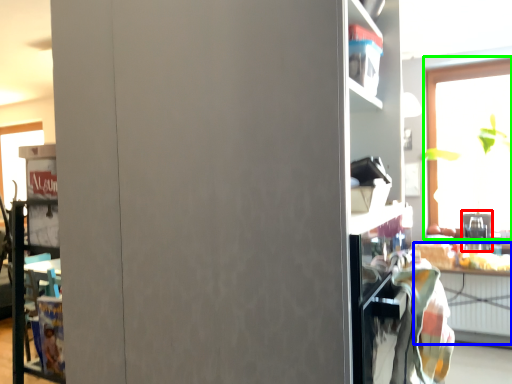
Question: Considering the real-world distances, which object is farthest from appliance (highlighted by a red box)? table (highlighted by a blue box) or window (highlighted by a green box)?

Choices:
 (A) table
 (B) window

Answer: (B)